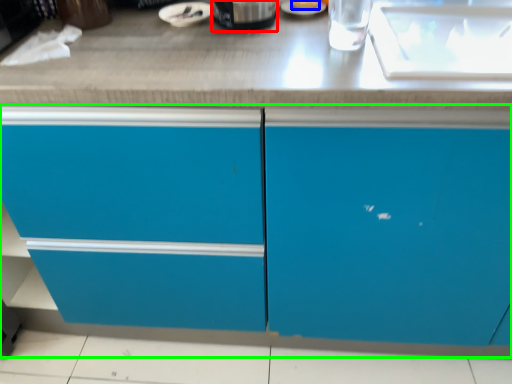
Question: Which is nearer to the appliance (highlighted by a red box)? food (highlighted by a blue box) or cabinetry (highlighted by a green box).

Choices:
 (A) food
 (B) cabinetry

Answer: (A)